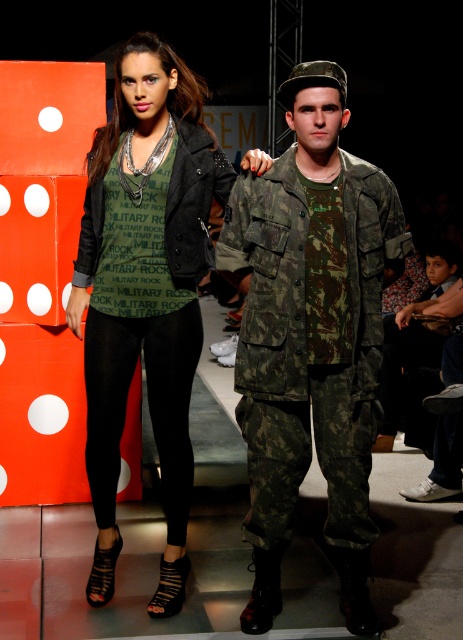
You are a fashion designer who needs to create a matching accessory for both models. Given the distance between the camo fabric uniform at center and the matte black leggings at center is 17.52 inches, what is the minimum length of the accessory needed to connect them?

The minimum length of the accessory needed to connect the camo fabric uniform at center and the matte black leggings at center is 17.52 inches.

You are a fashion designer observing the runway show. You need to determine the spatial relationship between the camo fabric uniform at center and the matte black leggings at center. Which one is positioned lower in the image?

The camo fabric uniform at center is located below matte black leggings at center, so it is positioned lower in the image.

You are a fashion designer analyzing the runway image. You notice the camo fabric uniform at center and the matte black leggings at center. Which of these two items has a shorter length?

The camo fabric uniform at center is shorter than the matte black leggings at center.